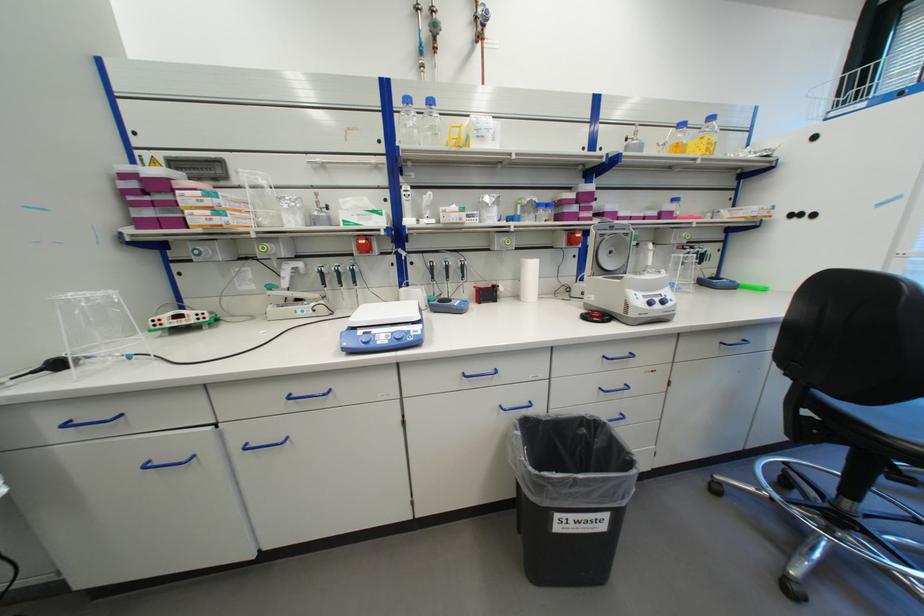
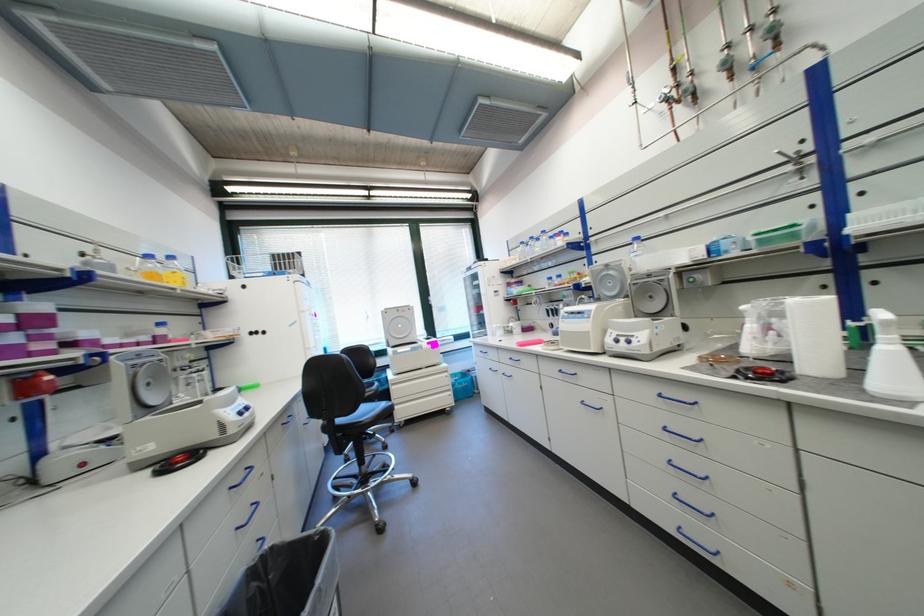
Question: The camera is either moving clockwise (left) or counter-clockwise (right) around the object. The first image is from the beginning of the video and the second image is from the end. Is the camera moving left or right when shooting the video?

Choices:
 (A) Left
 (B) Right

Answer: (A)